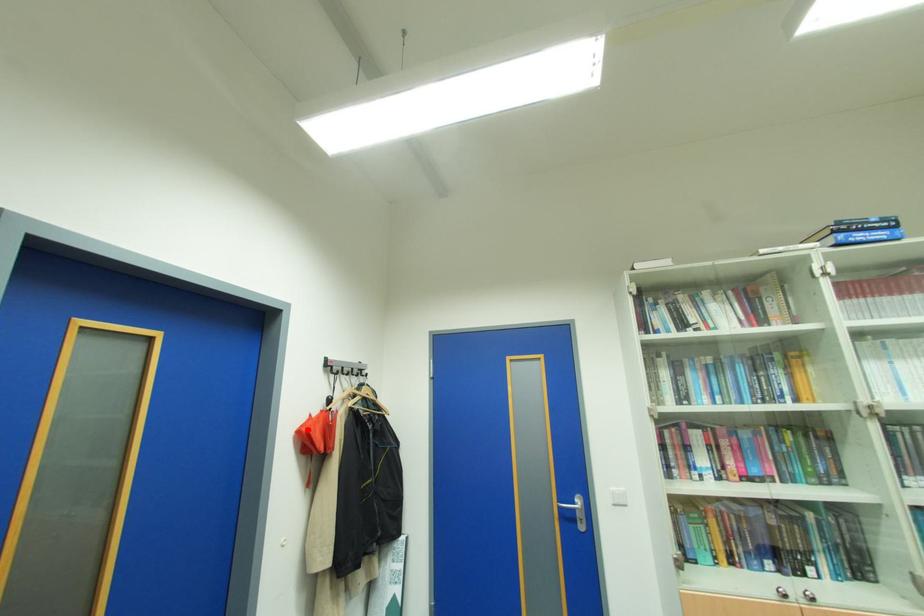
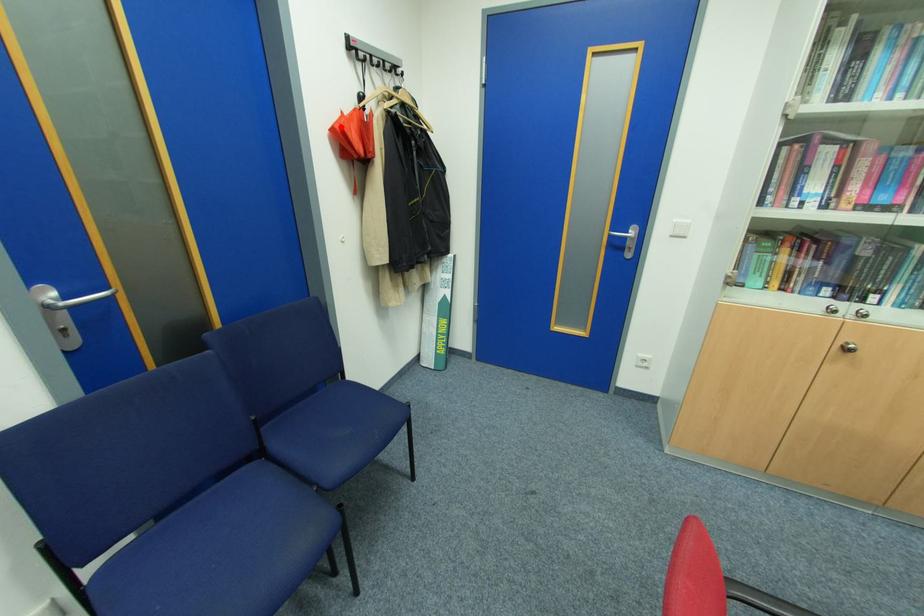
Consider the image. I am providing you with two images of the same scene from different viewpoints. A red point is marked on the first image and another point is marked on the second image. Is the marked point in image1 the same physical position as the marked point in image2?

Yes